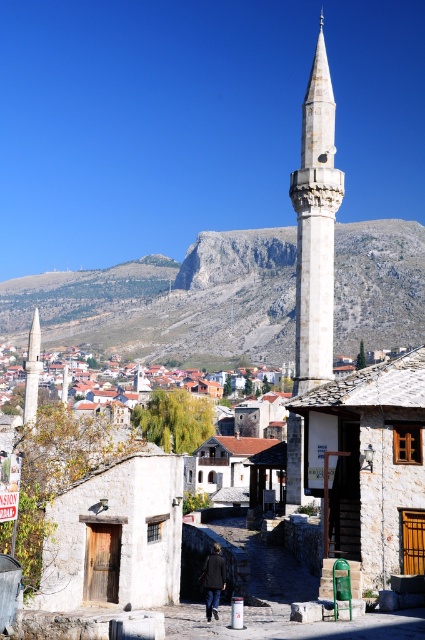
Question: Which object is positioned farthest from the rocky gray mountain at upper center?

Choices:
 (A) white stone minaret at left
 (B) white stone minaret at center

Answer: (A)

Question: Does rocky gray mountain at upper center appear on the left side of white stone minaret at center?

Choices:
 (A) yes
 (B) no

Answer: (A)

Question: Which point is closer to the camera?

Choices:
 (A) white stone minaret at left
 (B) white stone minaret at center
 (C) rocky gray mountain at upper center

Answer: (B)

Question: Is rocky gray mountain at upper center closer to the viewer compared to white stone minaret at center?

Choices:
 (A) no
 (B) yes

Answer: (A)

Question: Which point appears farthest from the camera in this image?

Choices:
 (A) (331, 340)
 (B) (39, 342)

Answer: (B)

Question: From the image, what is the correct spatial relationship of rocky gray mountain at upper center in relation to white stone minaret at left?

Choices:
 (A) above
 (B) below

Answer: (A)